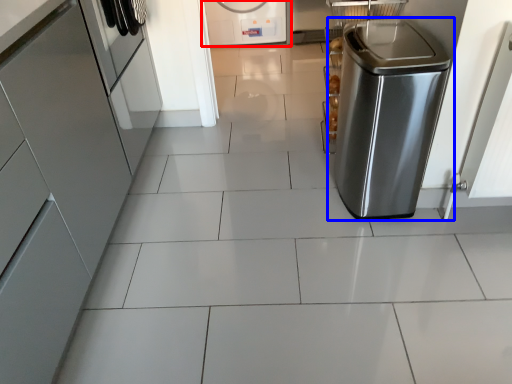
Question: Among these objects, which one is nearest to the camera, home appliance (highlighted by a red box) or home appliance (highlighted by a blue box)?

Choices:
 (A) home appliance
 (B) home appliance

Answer: (B)